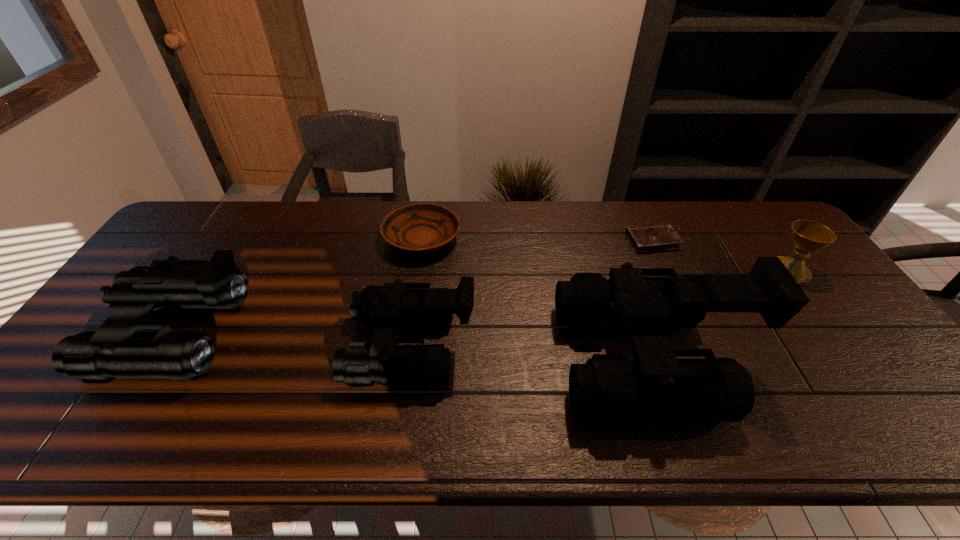
Locate an element on the screen. Image resolution: width=960 pixels, height=540 pixels. diary present at the far edge is located at coordinates click(647, 238).

This screenshot has width=960, height=540. What are the coordinates of `object located at the left edge` in the screenshot? It's located at (116, 350).

This screenshot has width=960, height=540. I want to click on object that is at the right edge, so [x=807, y=237].

Identify the location of object situated at the near left corner. The width and height of the screenshot is (960, 540). (116, 350).

The height and width of the screenshot is (540, 960). Find the location of `vacant space at the far edge of the desktop`. vacant space at the far edge of the desktop is located at coordinates (687, 233).

Locate an element on the screen. Image resolution: width=960 pixels, height=540 pixels. vacant space at the left edge is located at coordinates (189, 251).

In the image, there is a desktop. Where is `free space at the far left corner`? The height and width of the screenshot is (540, 960). free space at the far left corner is located at coordinates (181, 222).

In the image, there is a desktop. At what (x,y) coordinates should I click in order to perform the action: click on vacant space at the near left corner. Please return your answer as a coordinate pair (x, y). The width and height of the screenshot is (960, 540). Looking at the image, I should click on (91, 395).

Identify the location of free space between the second shortest binoculars and the third shortest object. The width and height of the screenshot is (960, 540). (488, 302).

Where is `free area in between the second tallest binoculars and the second binoculars from left to right`? free area in between the second tallest binoculars and the second binoculars from left to right is located at coordinates (299, 340).